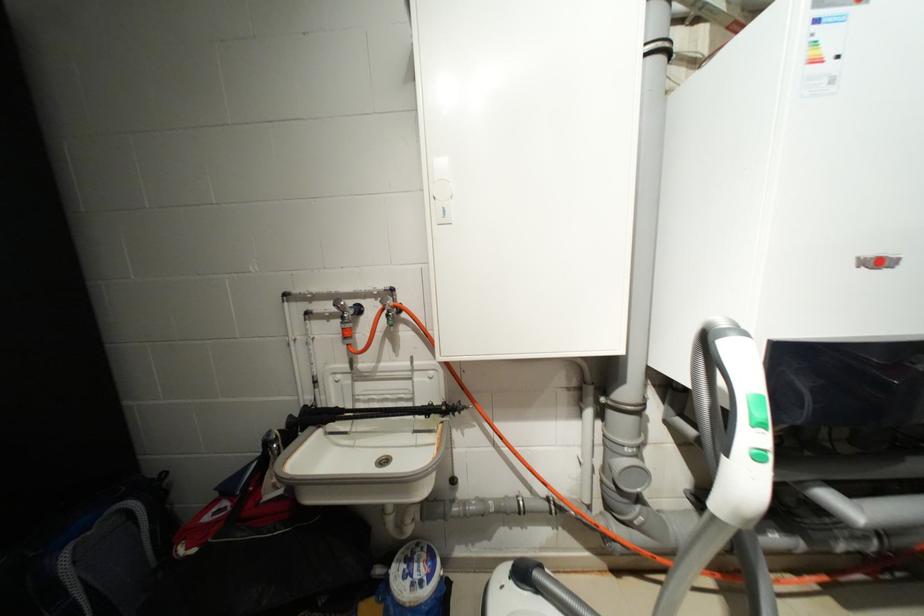
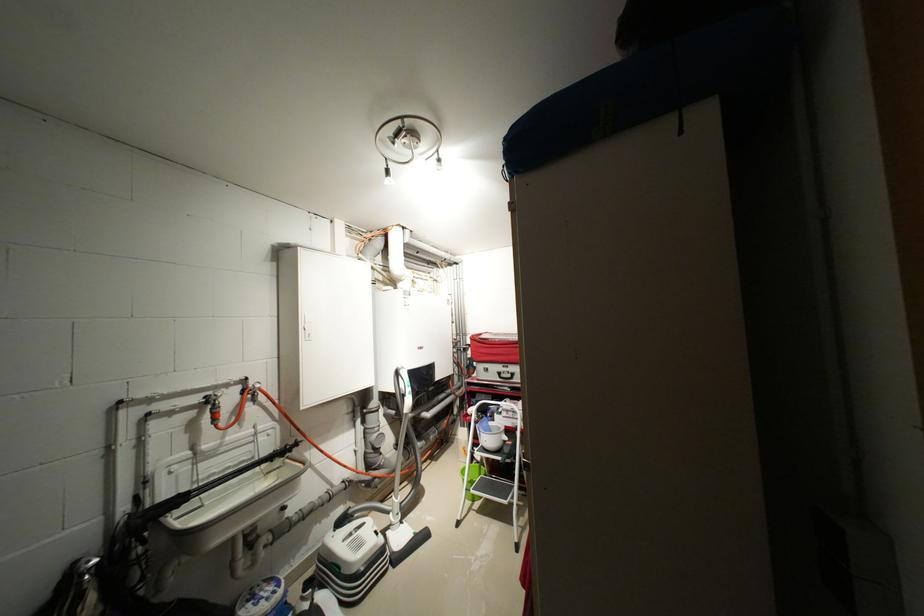
Find the pixel in the second image that matches (x=434, y=381) in the first image.

(273, 439)